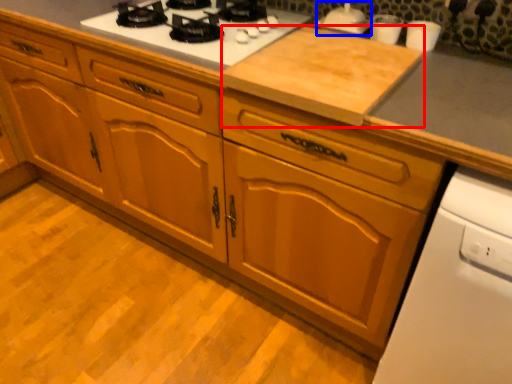
Question: Which of the following is the farthest to the observer, plywood (highlighted by a red box) or appliance (highlighted by a blue box)?

Choices:
 (A) plywood
 (B) appliance

Answer: (B)